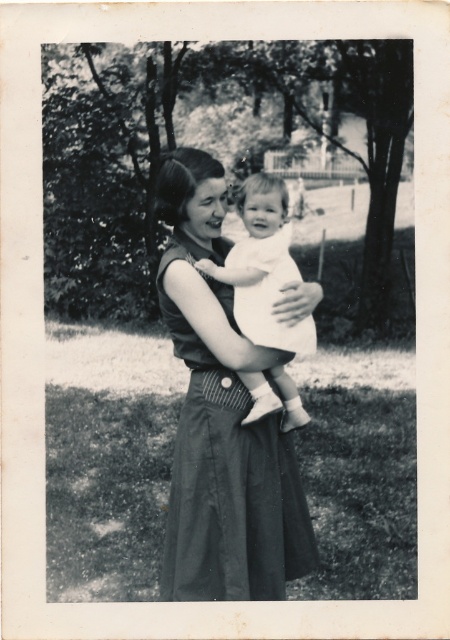
You are a photographer trying to capture a closeup shot of the white clothed baby at center and the white cotton dress at center in the image. Given that your camera has a minimum focus distance of 2.5 inches, will you be able to focus on both subjects simultaneously?

The white clothed baby at center is 2.45 inches away from the white cotton dress at center, which is within the camera minimum focus distance of 2.5 inches. Therefore, you can focus on both subjects simultaneously.

You are a photographer trying to focus on the white clothed baby at center. What are the coordinates where you should aim your camera lens?

The white clothed baby at center is located at coordinates point (x=262, y=266), so you should aim your camera lens at those coordinates to focus on the baby.